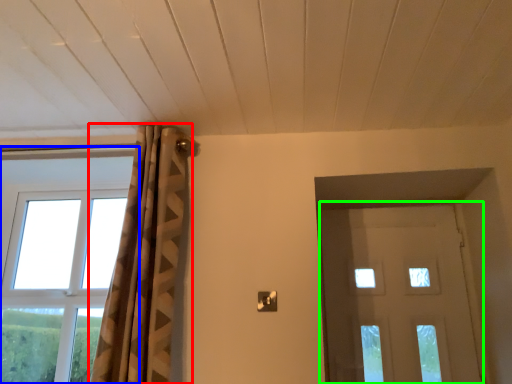
Question: Which object is the farthest from curtain (highlighted by a red box)? Choose among these: window (highlighted by a blue box) or door (highlighted by a green box).

Choices:
 (A) window
 (B) door

Answer: (B)